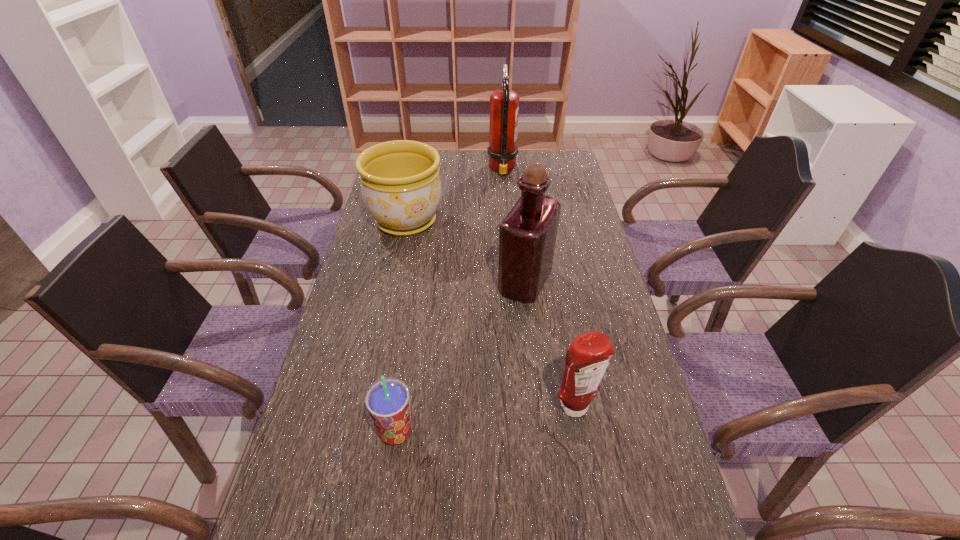
Where is `free space between the fourth nearest object and the third farthest object`? The width and height of the screenshot is (960, 540). free space between the fourth nearest object and the third farthest object is located at coordinates (466, 252).

At what (x,y) coordinates should I click in order to perform the action: click on free spot between the liquor and the fourth nearest object. Please return your answer as a coordinate pair (x, y). The height and width of the screenshot is (540, 960). Looking at the image, I should click on (466, 252).

Find the location of `free space between the liquor and the smoothie`. free space between the liquor and the smoothie is located at coordinates (461, 357).

Where is `vacant region between the condiment and the flowerpot`? vacant region between the condiment and the flowerpot is located at coordinates (491, 314).

In order to click on free space that is in between the fourth nearest object and the smoothie in this screenshot , I will do `click(401, 327)`.

Identify which object is located as the second nearest to the smoothie. Please provide its 2D coordinates. Your answer should be formatted as a tuple, i.e. [(x, y)], where the tuple contains the x and y coordinates of a point satisfying the conditions above.

[(527, 236)]

Identify which object is the second closest to the flowerpot. Please provide its 2D coordinates. Your answer should be formatted as a tuple, i.e. [(x, y)], where the tuple contains the x and y coordinates of a point satisfying the conditions above.

[(504, 104)]

I want to click on vacant area in the image that satisfies the following two spatial constraints: 1. at the nozzle of the farthest object; 2. on the front side of the fourth nearest object, so click(x=506, y=221).

Identify the location of vacant space that satisfies the following two spatial constraints: 1. at the nozzle of the farthest object; 2. on the back side of the liquor. The image size is (960, 540). (511, 282).

You are a GUI agent. You are given a task and a screenshot of the screen. Output one action in this format:
    pyautogui.click(x=<x>, y=<y>)
    Task: Click on the free space that satisfies the following two spatial constraints: 1. on the front side of the third nearest object; 2. on the right side of the condiment
    This screenshot has width=960, height=540.
    Given the screenshot: What is the action you would take?
    pyautogui.click(x=539, y=407)